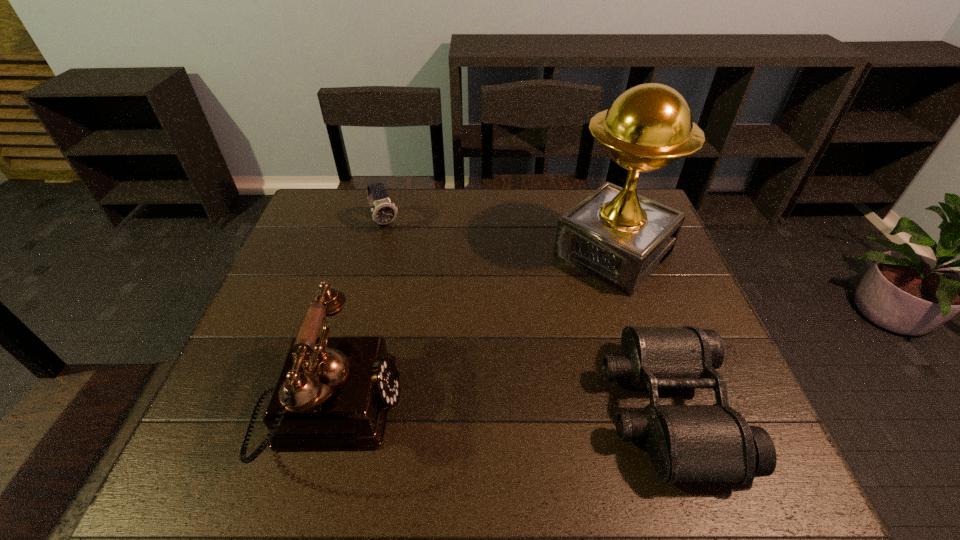
Image resolution: width=960 pixels, height=540 pixels. In order to click on the second tallest object in this screenshot , I will do `click(333, 392)`.

The height and width of the screenshot is (540, 960). I want to click on the shortest object, so [x=686, y=443].

The image size is (960, 540). What are the coordinates of `the third tallest object` in the screenshot? It's located at (384, 211).

Find the location of a particular element. the tallest object is located at coordinates (615, 235).

Identify the location of vacant area situated on the dial of the telephone. The width and height of the screenshot is (960, 540). (532, 410).

Locate an element on the screen. free region located 0.180m through the eyepieces of the binoculars is located at coordinates click(522, 408).

The width and height of the screenshot is (960, 540). What are the coordinates of `vacant region located 0.320m through the eyepieces of the binoculars` in the screenshot? It's located at (456, 408).

This screenshot has width=960, height=540. In order to click on vacant region located 0.060m through the eyepieces of the binoculars in this screenshot , I will do `click(579, 408)`.

At what (x,y) coordinates should I click in order to perform the action: click on free space located 0.110m on the face of the third tallest object. Please return your answer as a coordinate pair (x, y). This screenshot has width=960, height=540. Looking at the image, I should click on (400, 256).

Locate an element on the screen. vacant position located 0.270m on the face of the third tallest object is located at coordinates (420, 292).